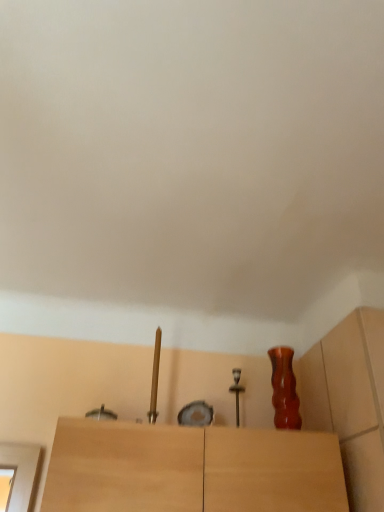
In order to face translucent amber vase at upper right, should I rotate leftwards or rightwards?

To face it directly, rotate right by 11.983 degrees.

The image size is (384, 512). What are the coordinates of `translucent amber vase at upper right` in the screenshot? It's located at (284, 389).

This screenshot has height=512, width=384. What do you see at coordinates (284, 389) in the screenshot?
I see `translucent amber vase at upper right` at bounding box center [284, 389].

The width and height of the screenshot is (384, 512). What are the coordinates of `translucent amber vase at upper right` in the screenshot? It's located at (284, 389).